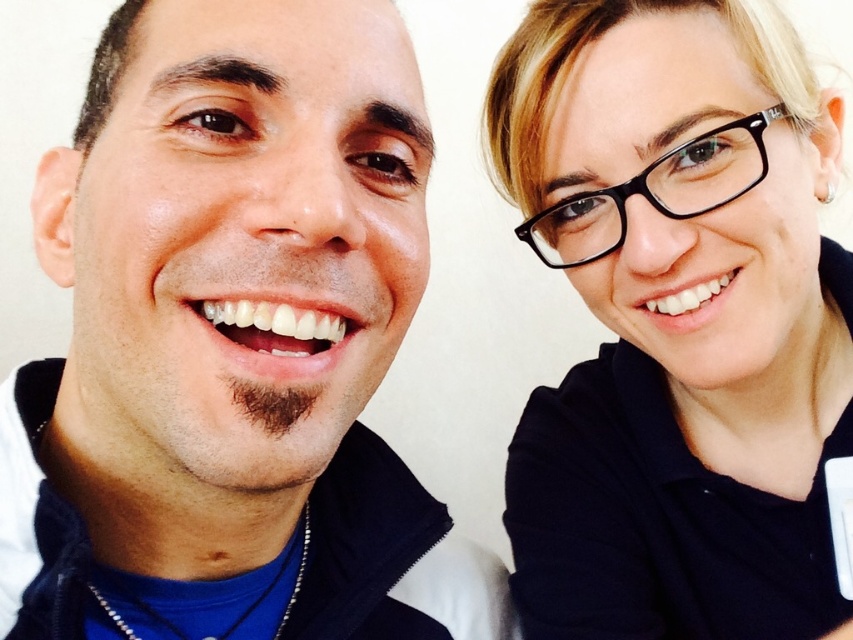
You are trying to decide which item is taller between the matte black jacket at left and the black matte glasses at upper right. Based on the scene, which one is taller?

The matte black jacket at left is not as tall as the black matte glasses at upper right, so the black matte glasses at upper right are taller.